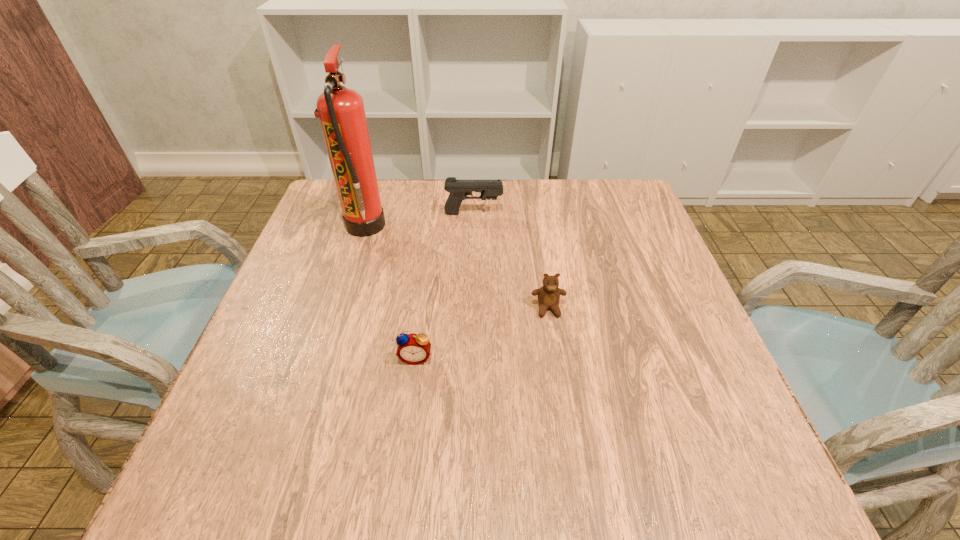
Identify the location of fire extinguisher that is at the far edge. This screenshot has height=540, width=960. (341, 111).

Identify the location of pistol situated at the far edge. (459, 189).

Locate an element on the screen. The width and height of the screenshot is (960, 540). object positioned at the left edge is located at coordinates (341, 111).

Locate an element on the screen. This screenshot has width=960, height=540. object located in the far left corner section of the desktop is located at coordinates (341, 111).

The height and width of the screenshot is (540, 960). I want to click on vacant area at the far edge, so click(x=441, y=188).

The height and width of the screenshot is (540, 960). I want to click on free space at the near edge of the desktop, so click(418, 458).

Where is `blank space at the left edge of the desktop`? This screenshot has width=960, height=540. blank space at the left edge of the desktop is located at coordinates (356, 268).

Where is `free spot at the right edge of the desktop`? Image resolution: width=960 pixels, height=540 pixels. free spot at the right edge of the desktop is located at coordinates (660, 411).

Image resolution: width=960 pixels, height=540 pixels. In order to click on vacant position at the far right corner of the desktop in this screenshot , I will do `click(611, 227)`.

Image resolution: width=960 pixels, height=540 pixels. Identify the location of free space between the pistol and the fire extinguisher. (419, 220).